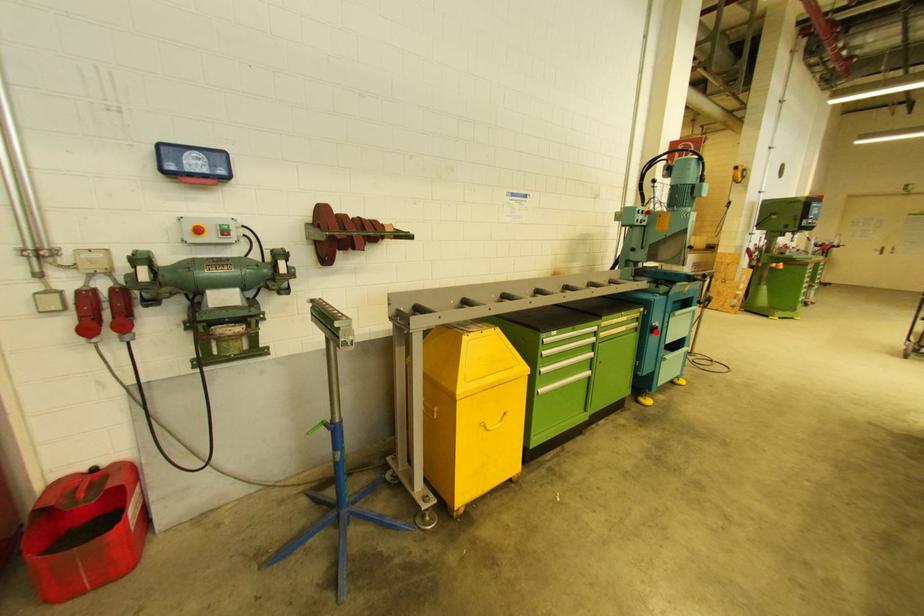
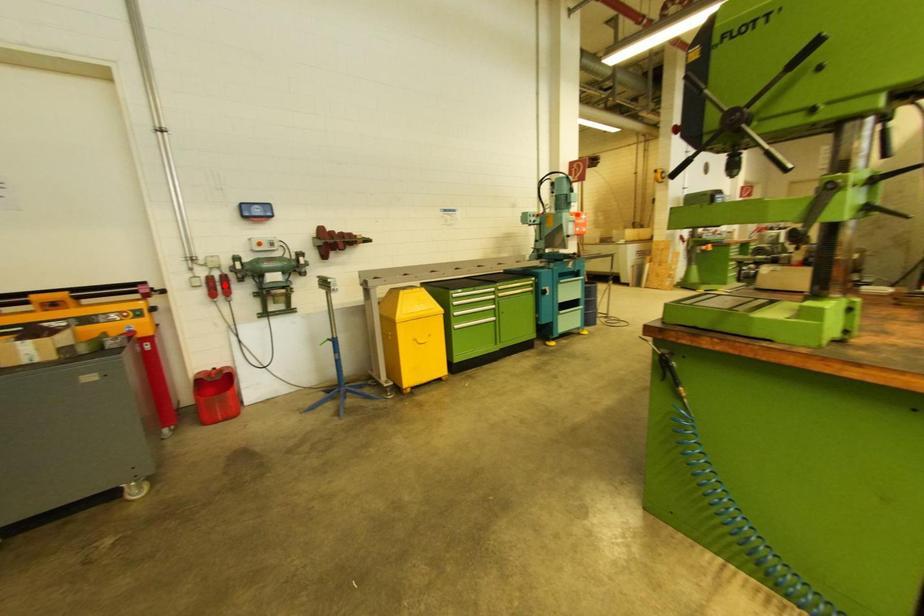
I am providing you with two images of the same scene from different viewpoints. A red point is marked on the first image and another point is marked on the second image. Is the red point in image1 aligned with the point shown in image2?

No